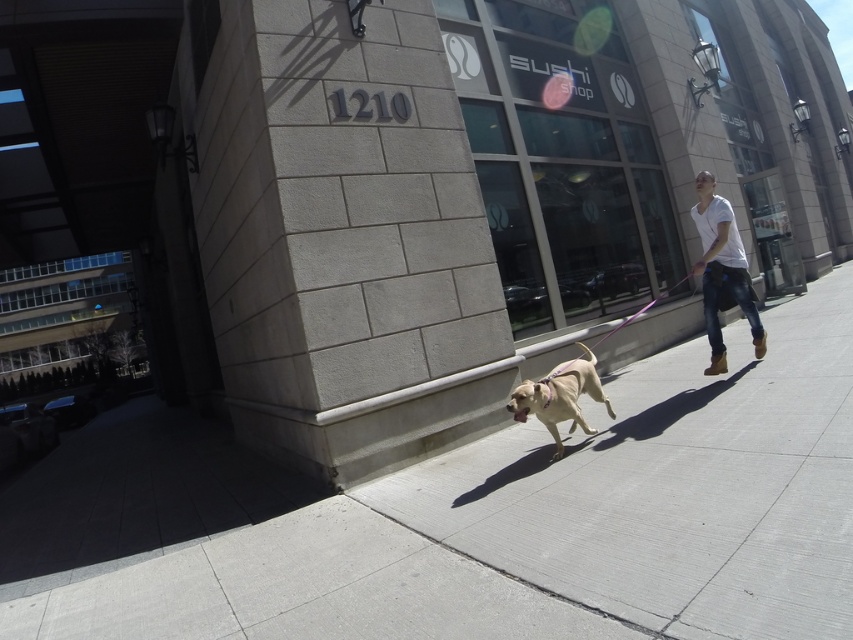
Is point (750, 289) behind point (595, 396)?

Yes, it is.

Is white cotton shirt at right thinner than golden fur dog at center?

Correct, white cotton shirt at right's width is less than golden fur dog at center's.

Where is `white cotton shirt at right`? The image size is (853, 640). white cotton shirt at right is located at coordinates (722, 272).

Does gray concrete sidewalk at lower center lie in front of golden fur dog at center?

Yes, gray concrete sidewalk at lower center is in front of golden fur dog at center.

Which is behind, point (459, 586) or point (595, 356)?

Positioned behind is point (595, 356).

Find the location of a particular element. gray concrete sidewalk at lower center is located at coordinates (544, 524).

Is gray concrete sidewalk at lower center wider than white cotton shirt at right?

Yes.

Is gray concrete sidewalk at lower center thinner than white cotton shirt at right?

No.

Is point (252, 528) positioned after point (695, 176)?

No, it is in front of (695, 176).

The width and height of the screenshot is (853, 640). I want to click on gray concrete sidewalk at lower center, so click(544, 524).